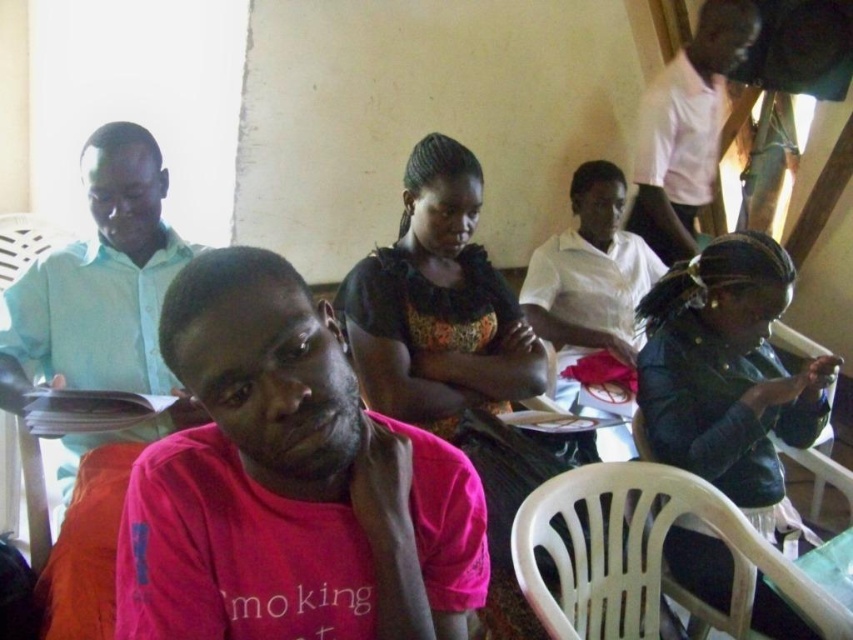
Question: Which object is farther from the camera taking this photo?

Choices:
 (A) black floral dress at center
 (B) matte black shirt at center
 (C) light blue shirt at left

Answer: (B)

Question: Is matte black shirt at center thinner than matte plastic chair at left?

Choices:
 (A) no
 (B) yes

Answer: (A)

Question: Is black floral dress at center behind light blue shirt at left?

Choices:
 (A) no
 (B) yes

Answer: (B)

Question: Which point is farther to the camera?

Choices:
 (A) (231, 602)
 (B) (577, 328)
 (C) (695, 202)

Answer: (C)

Question: Which object is the closest to the matte black shirt at center?

Choices:
 (A) light blue shirt at left
 (B) matte plastic chair at left

Answer: (A)

Question: Can you confirm if pink matte shirt at center is thinner than light blue shirt at left?

Choices:
 (A) yes
 (B) no

Answer: (A)